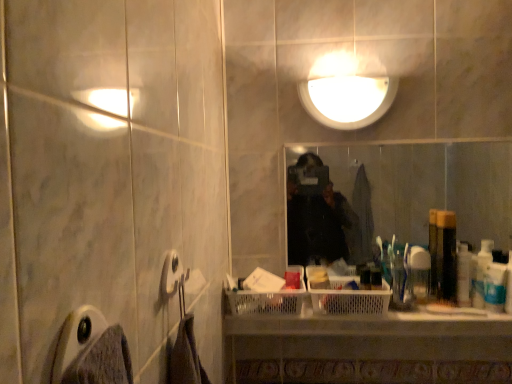
Question: From the image's perspective, is white glossy light fixture at upper center located above or below white plastic bottle at right, the fifth toiletry positioned from the left?

Choices:
 (A) above
 (B) below

Answer: (A)

Question: Is white glossy light fixture at upper center taller or shorter than white plastic bottle at right, the fifth toiletry positioned from the left?

Choices:
 (A) short
 (B) tall

Answer: (B)

Question: Based on their relative distances, which object is farther from the clear plastic cup at right, the 5th toiletry in the right-to-left sequence?

Choices:
 (A) white plastic toothbrush at right, which ranks as the 2th toiletry in right-to-left order
 (B) translucent plastic bottle at right, arranged as the third toiletry when viewed from the left
 (C) clear plastic mirror at center
 (D) white glossy light fixture at upper center
 (E) white plastic bottle at right, the fifth toiletry positioned from the left

Answer: (C)

Question: Based on their relative distances, which object is farther from the white plastic bottle at right, which is the first toiletry in right-to-left order?

Choices:
 (A) clear plastic cup at right, the 5th toiletry in the right-to-left sequence
 (B) gray fabric towel bar at lower left
 (C) translucent plastic bottle at right, the 2th toiletry from the left
 (D) translucent plastic bottle at right, arranged as the third toiletry when viewed from the left
 (E) white glossy light fixture at upper center

Answer: (B)